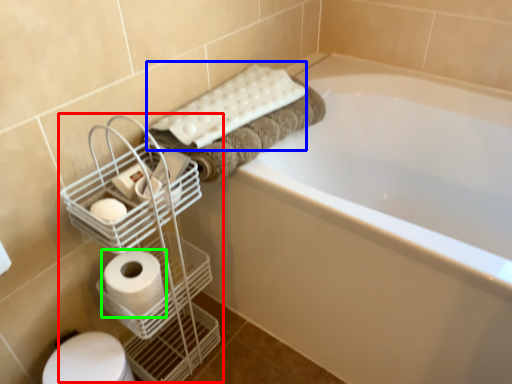
Question: Which object is the closest to the bird cage (highlighted by a red box)? Choose among these: bath towel (highlighted by a blue box) or toilet paper (highlighted by a green box).

Choices:
 (A) bath towel
 (B) toilet paper

Answer: (B)